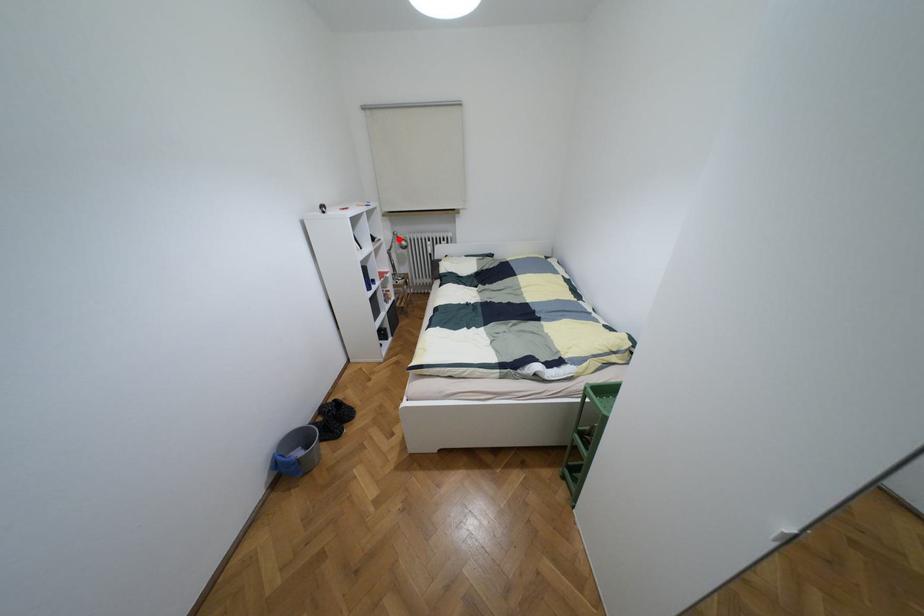
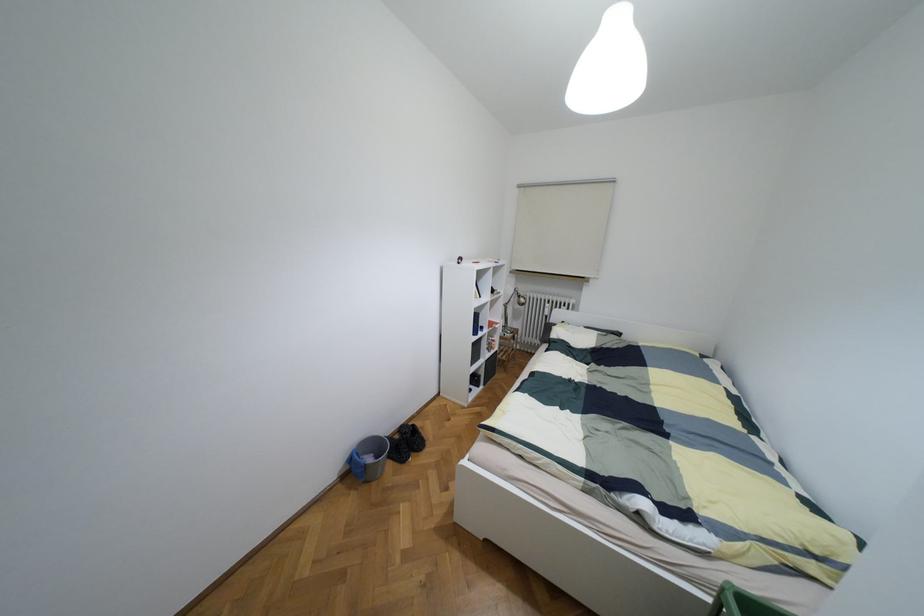
Where in the second image is the point corresponding to the highlighted location from the first image?

(517, 296)